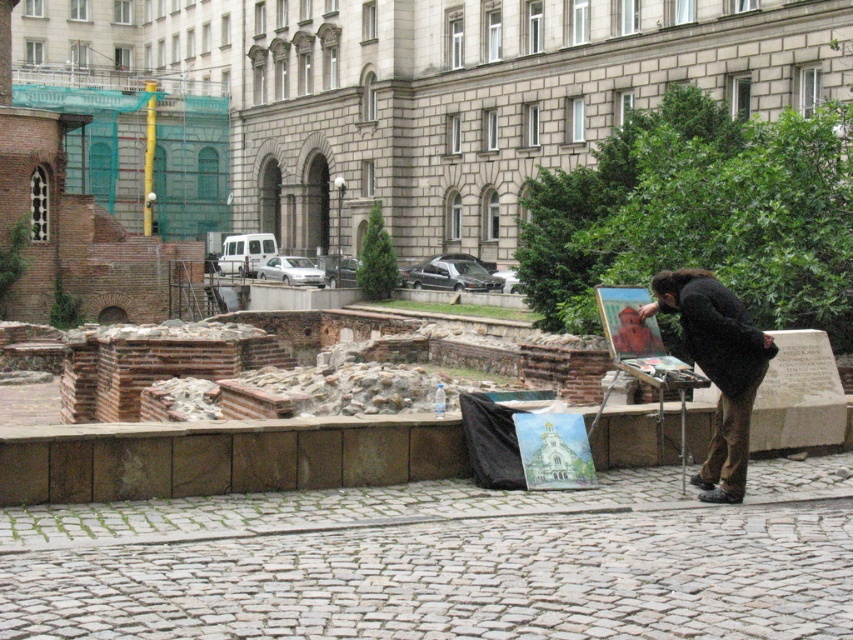
Measure the distance from black fabric at right to wooden easel at center.

black fabric at right is 15.11 inches from wooden easel at center.

Does black fabric at right come in front of wooden easel at center?

Yes.

The height and width of the screenshot is (640, 853). Identify the location of black fabric at right. (717, 368).

Identify the location of black fabric at right. Image resolution: width=853 pixels, height=640 pixels. (717, 368).